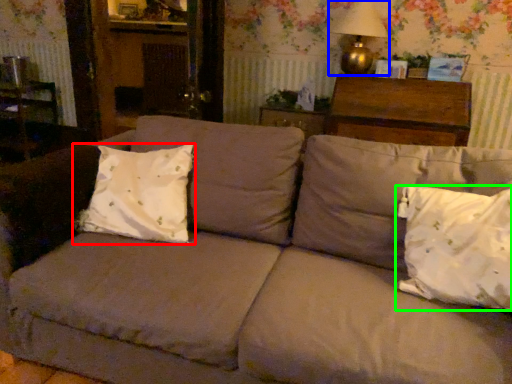
Question: Which object is the closest to the pillow (highlighted by a red box)? Choose among these: table lamp (highlighted by a blue box) or pillow (highlighted by a green box).

Choices:
 (A) table lamp
 (B) pillow

Answer: (B)